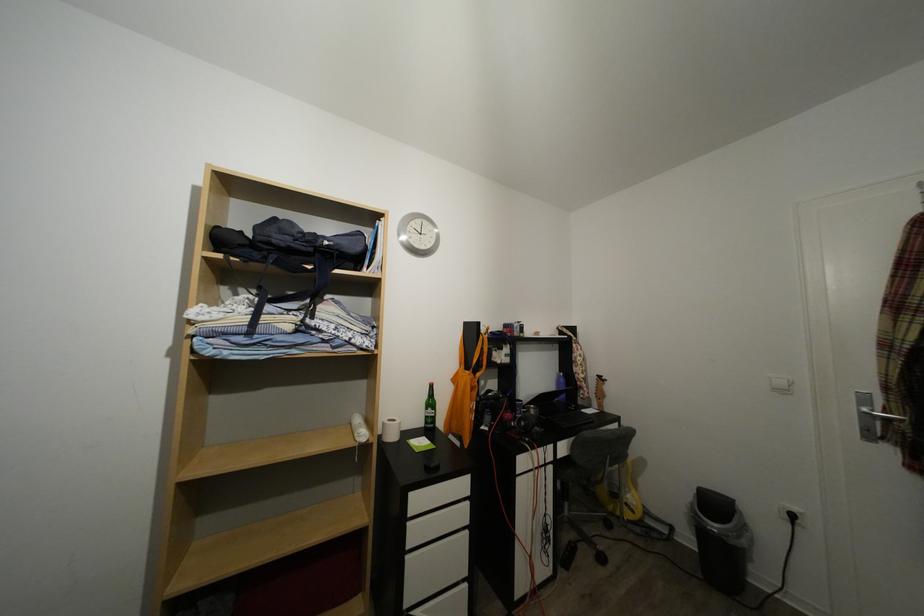
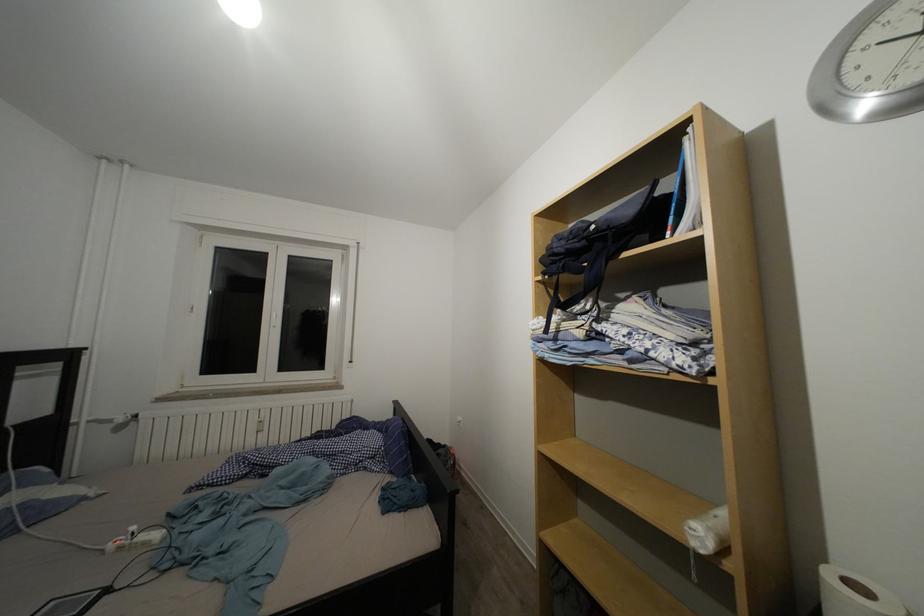
Question: How did the camera likely rotate?

Choices:
 (A) Left
 (B) Right
 (C) Up
 (D) Down

Answer: (A)